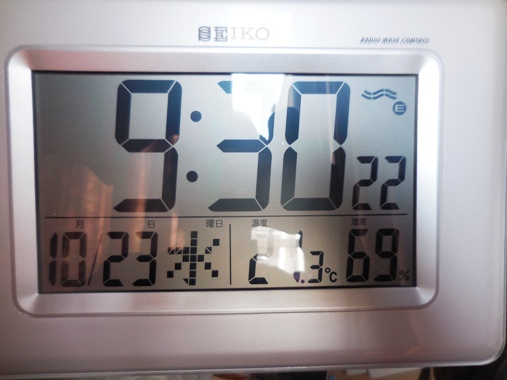
What are the coordinates of `screen` in the screenshot? It's located at (217, 180).